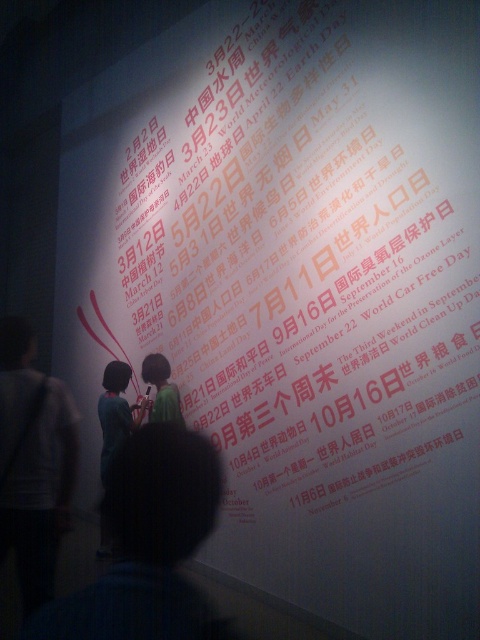
Question: Considering the relative positions of dark blue shirt at center and dark green shirt at center in the image provided, where is dark blue shirt at center located with respect to dark green shirt at center?

Choices:
 (A) above
 (B) below

Answer: (A)

Question: Can you confirm if dark blue shirt at center is thinner than dark green shirt at center?

Choices:
 (A) no
 (B) yes

Answer: (B)

Question: Which object is closer to the camera taking this photo?

Choices:
 (A) dark green shirt at center
 (B) light gray jacket at left

Answer: (B)

Question: Can you confirm if dark blue shirt at center is positioned to the right of green fabric shirt at center?

Choices:
 (A) no
 (B) yes

Answer: (B)

Question: Among these points, which one is nearest to the camera?

Choices:
 (A) (194, 480)
 (B) (47, 522)
 (C) (170, 413)
 (D) (107, 531)

Answer: (A)

Question: Which point is closer to the camera taking this photo?

Choices:
 (A) (15, 525)
 (B) (101, 467)
 (C) (164, 406)

Answer: (A)